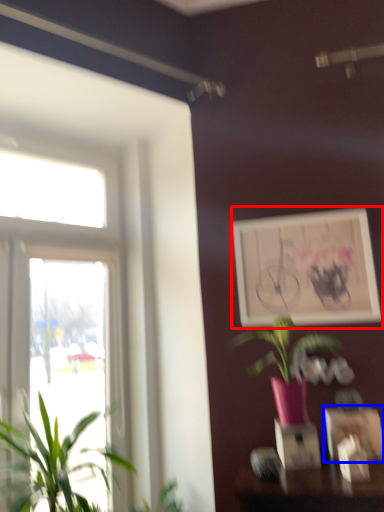
Question: Among these objects, which one is nearest to the camera, picture frame (highlighted by a red box) or picture frame (highlighted by a blue box)?

Choices:
 (A) picture frame
 (B) picture frame

Answer: (B)